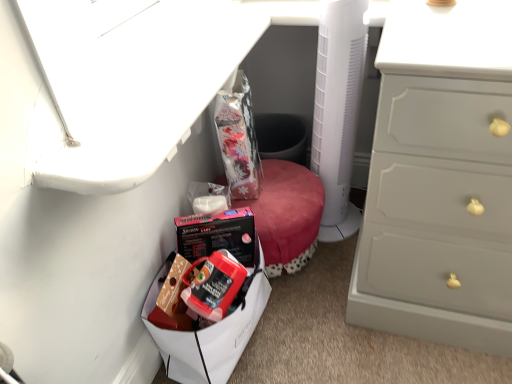
Question: In terms of width, does matte plastic lunch box at lower left look wider or thinner when compared to white plastic fan at center?

Choices:
 (A) thin
 (B) wide

Answer: (B)

Question: Relative to white plastic fan at center, is matte plastic lunch box at lower left in front or behind?

Choices:
 (A) behind
 (B) front

Answer: (B)

Question: Considering the real-world distances, which object is farthest from the white plastic fan at center?

Choices:
 (A) metallic silver vanity at upper left
 (B) matte black box at lower center
 (C) matte plastic lunch box at lower left

Answer: (C)

Question: Which is nearer to the matte black box at lower center?

Choices:
 (A) metallic silver vanity at upper left
 (B) matte plastic lunch box at lower left
 (C) white plastic fan at center

Answer: (B)